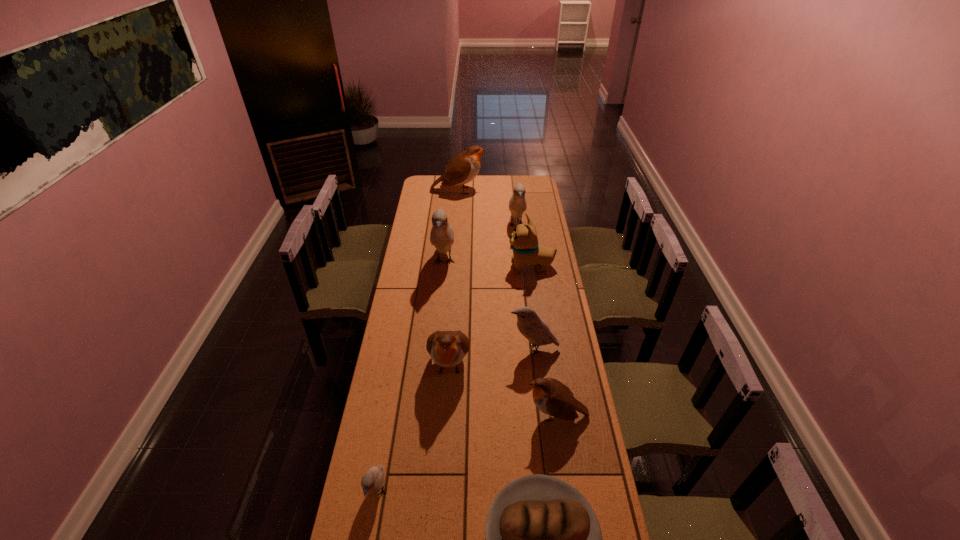
The height and width of the screenshot is (540, 960). Identify the location of the sixth farthest bird. (552, 397).

I want to click on the nearest white bird, so click(x=372, y=481).

The width and height of the screenshot is (960, 540). In order to click on the smallest white bird in this screenshot , I will do `click(372, 481)`.

The height and width of the screenshot is (540, 960). In order to click on vacant space located at the beak of the fifth nearest bird in this screenshot , I will do `click(442, 291)`.

Where is `vacant space located at the face of the farthest brown bird`? This screenshot has width=960, height=540. vacant space located at the face of the farthest brown bird is located at coordinates (495, 191).

The height and width of the screenshot is (540, 960). I want to click on free space located 0.380m at the beak of the sixth nearest bird, so click(x=523, y=285).

At what (x,y) coordinates should I click in order to perform the action: click on free space located on the face of the beige puppy. Please return your answer as a coordinate pair (x, y). The height and width of the screenshot is (540, 960). Looking at the image, I should click on (434, 267).

Find the location of a particular element. The image size is (960, 540). blank area located 0.110m on the face of the beige puppy is located at coordinates (487, 267).

The width and height of the screenshot is (960, 540). In order to click on free space located 0.070m on the face of the beige puppy in this screenshot , I will do `click(494, 267)`.

Locate an element on the screen. This screenshot has height=540, width=960. free space located at the face of the second smallest brown bird is located at coordinates (446, 417).